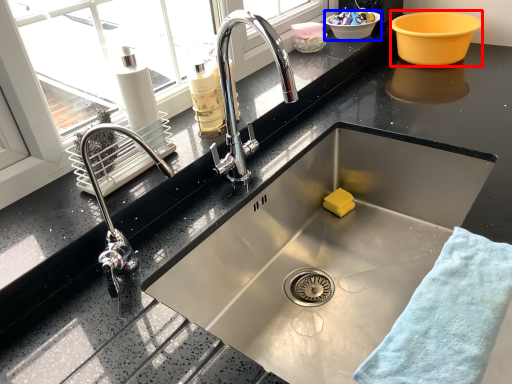
Question: Which of the following is the closest to the observer, basin (highlighted by a red box) or basin (highlighted by a blue box)?

Choices:
 (A) basin
 (B) basin

Answer: (A)